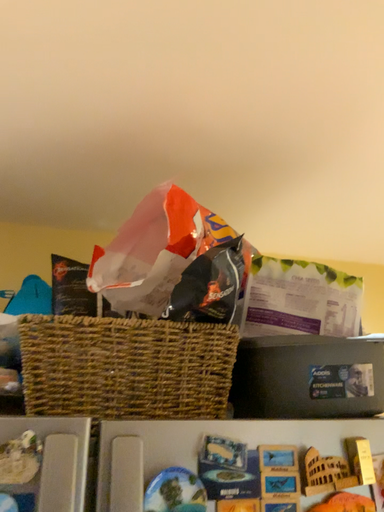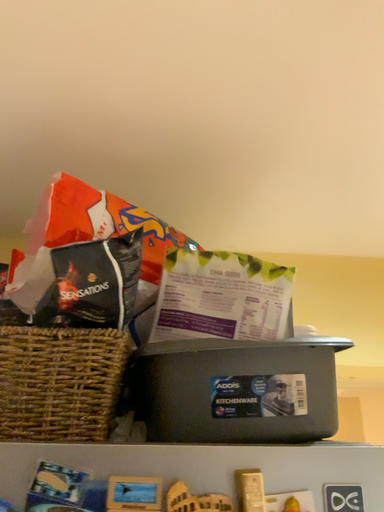
Question: How did the camera likely rotate when shooting the video?

Choices:
 (A) rotated left
 (B) rotated right

Answer: (A)